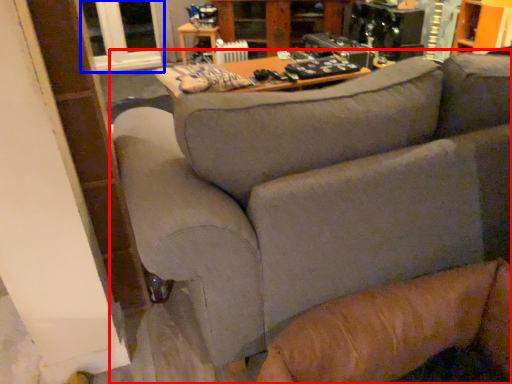
Question: Which object is further to the camera taking this photo, studio couch (highlighted by a red box) or window (highlighted by a blue box)?

Choices:
 (A) studio couch
 (B) window

Answer: (B)